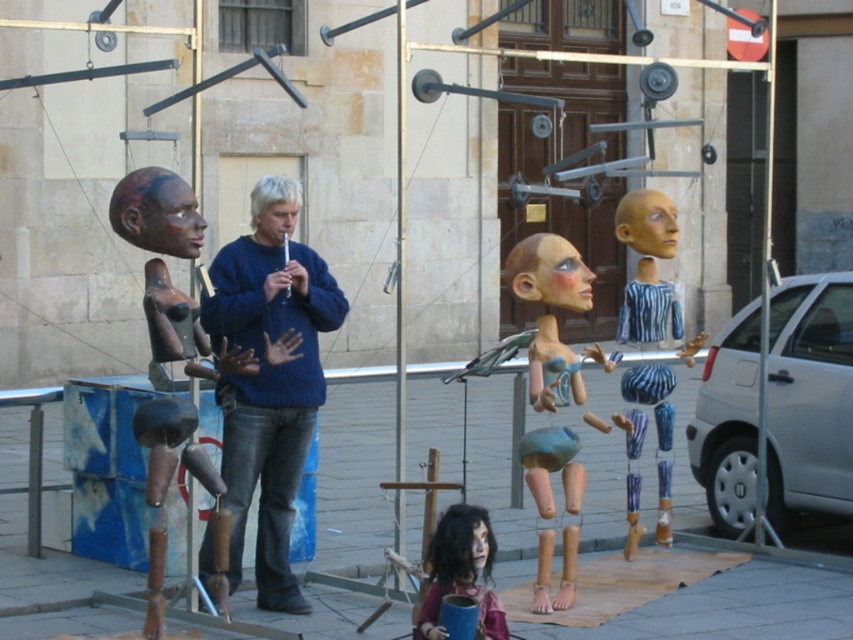
Question: Among these points, which one is nearest to the camera?

Choices:
 (A) (155, 237)
 (B) (283, 189)
 (C) (519, 282)

Answer: (A)

Question: Does blue sweater at center have a smaller size compared to matte brown head at center?

Choices:
 (A) yes
 (B) no

Answer: (B)

Question: Does wooden doll at center appear on the right side of matte plastic head at center?

Choices:
 (A) yes
 (B) no

Answer: (B)

Question: Observing the image, what is the correct spatial positioning of wooden doll at center in reference to matte brown hair at center?

Choices:
 (A) left
 (B) right

Answer: (B)

Question: Which point is closer to the camera?

Choices:
 (A) (654, 205)
 (B) (581, 380)

Answer: (B)

Question: Which point appears farthest from the camera in this image?

Choices:
 (A) (549, 301)
 (B) (462, 536)

Answer: (A)